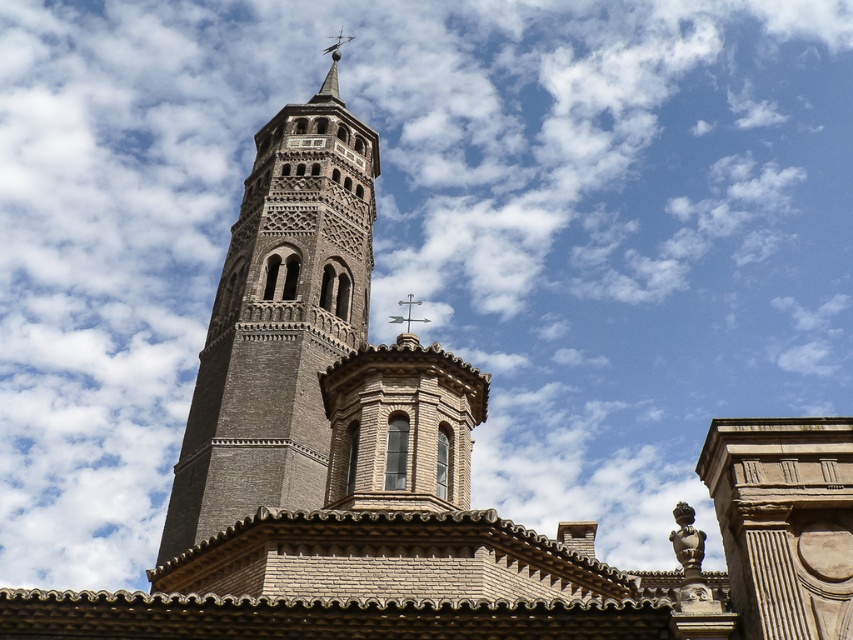
You are standing in front of the historic building and want to take a photo of the brown textured stone bell tower at center. Where should you position yourself to capture it in the frame?

You should position yourself directly in front of the brown textured stone bell tower at center, as it is located at the central point of the image at coordinates approximately 0.506 on the x axis and 0.327 on the y axis.

You are an architect evaluating the structural integrity of the brown textured stone bell tower at center and the polished silver spire at upper center. Based on their spatial dimensions, which one might require more reinforcement to withstand strong winds?

The polished silver spire at upper center might require more reinforcement because it occupies more space than the brown textured stone bell tower at center, making it more susceptible to wind forces.

From the picture: You are standing in front of the historic building and notice two points marked on the facade. The first point is at coordinates point (219, 465) and the second is at point (334, 52). Which point is closer to you?

Point (219, 465) is in front of point (334, 52), so it is closer to you.